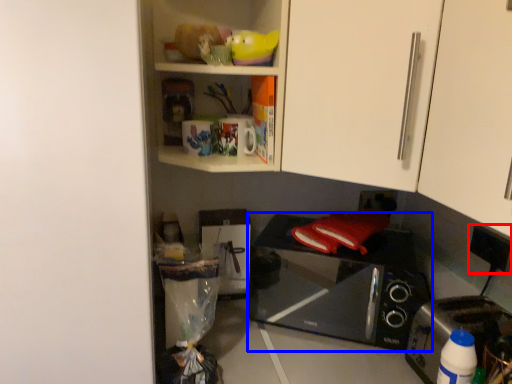
Question: Which of the following is the farthest to the observer, electric outlet (highlighted by a red box) or microwave oven (highlighted by a blue box)?

Choices:
 (A) electric outlet
 (B) microwave oven

Answer: (A)